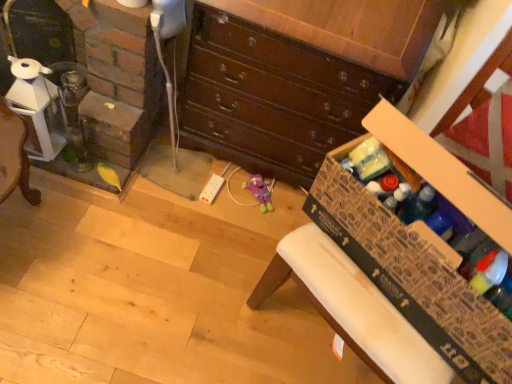
Question: Is clear glass fireplace at left facing away from wooden chest of drawers at center?

Choices:
 (A) yes
 (B) no

Answer: (B)

Question: Is clear glass fireplace at left not close to wooden chest of drawers at center?

Choices:
 (A) yes
 (B) no

Answer: (B)

Question: Does clear glass fireplace at left have a lesser width compared to wooden chest of drawers at center?

Choices:
 (A) no
 (B) yes

Answer: (A)

Question: Can you confirm if clear glass fireplace at left is taller than wooden chest of drawers at center?

Choices:
 (A) yes
 (B) no

Answer: (B)

Question: Considering the relative positions of clear glass fireplace at left and wooden chest of drawers at center in the image provided, is clear glass fireplace at left to the left of wooden chest of drawers at center from the viewer's perspective?

Choices:
 (A) yes
 (B) no

Answer: (A)

Question: Is clear glass fireplace at left not inside wooden chest of drawers at center?

Choices:
 (A) no
 (B) yes

Answer: (B)

Question: Is cardboard box at lower right positioned with its back to clear glass fireplace at left?

Choices:
 (A) no
 (B) yes

Answer: (A)

Question: Considering the relative sizes of cardboard box at lower right and clear glass fireplace at left in the image provided, is cardboard box at lower right taller than clear glass fireplace at left?

Choices:
 (A) yes
 (B) no

Answer: (B)

Question: Does cardboard box at lower right contain clear glass fireplace at left?

Choices:
 (A) yes
 (B) no

Answer: (B)

Question: Could you tell me if cardboard box at lower right is facing clear glass fireplace at left?

Choices:
 (A) yes
 (B) no

Answer: (B)

Question: Is cardboard box at lower right in front of clear glass fireplace at left?

Choices:
 (A) no
 (B) yes

Answer: (B)

Question: From a real-world perspective, is cardboard box at lower right under clear glass fireplace at left?

Choices:
 (A) yes
 (B) no

Answer: (B)

Question: From the image's perspective, does cardboard box at lower right appear higher than wooden chest of drawers at center?

Choices:
 (A) no
 (B) yes

Answer: (A)